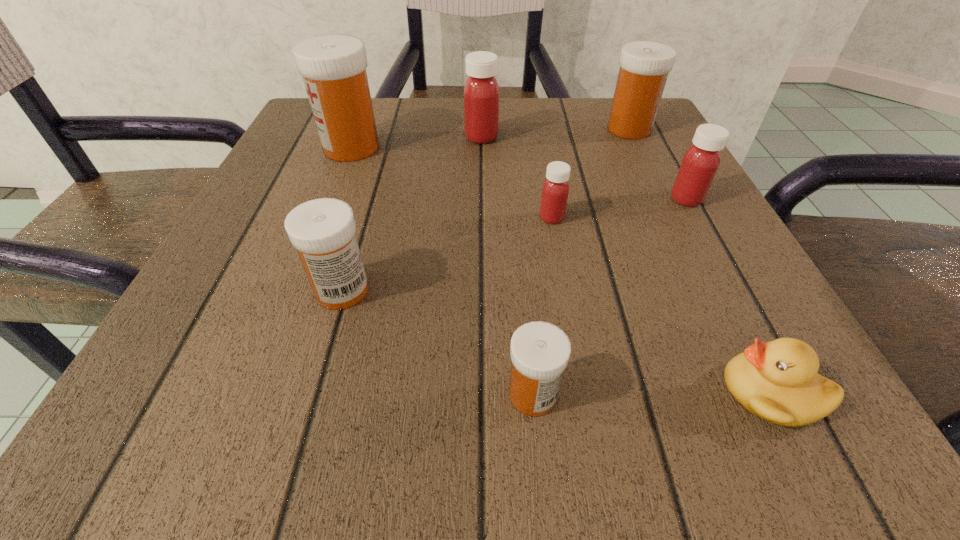
Where is `free location located 0.180m on the left of the nearest medicine`? free location located 0.180m on the left of the nearest medicine is located at coordinates (338, 394).

The width and height of the screenshot is (960, 540). Find the location of `free space located on the front-facing side of the yellow duckling`. free space located on the front-facing side of the yellow duckling is located at coordinates (372, 392).

The image size is (960, 540). In order to click on vacant space situated on the front-facing side of the yellow duckling in this screenshot , I will do `click(613, 392)`.

You are a GUI agent. You are given a task and a screenshot of the screen. Output one action in this format:
    pyautogui.click(x=<x>, y=<y>)
    Task: Click on the vacant space located 0.340m on the front-facing side of the yellow duckling
    
    Given the screenshot: What is the action you would take?
    pyautogui.click(x=409, y=392)

At what (x,y) coordinates should I click in order to perform the action: click on medicine at the near edge. Please return your answer as a coordinate pair (x, y). The image size is (960, 540). Looking at the image, I should click on (540, 351).

Locate an element on the screen. duckling located in the near edge section of the desktop is located at coordinates (777, 381).

Find the location of a particular element. The height and width of the screenshot is (540, 960). duckling present at the right edge is located at coordinates (777, 381).

This screenshot has width=960, height=540. What are the coordinates of `object that is at the far left corner` in the screenshot? It's located at click(x=333, y=67).

Identify the location of object positioned at the far right corner. (644, 65).

The width and height of the screenshot is (960, 540). Find the location of `object that is at the near right corner`. object that is at the near right corner is located at coordinates (777, 381).